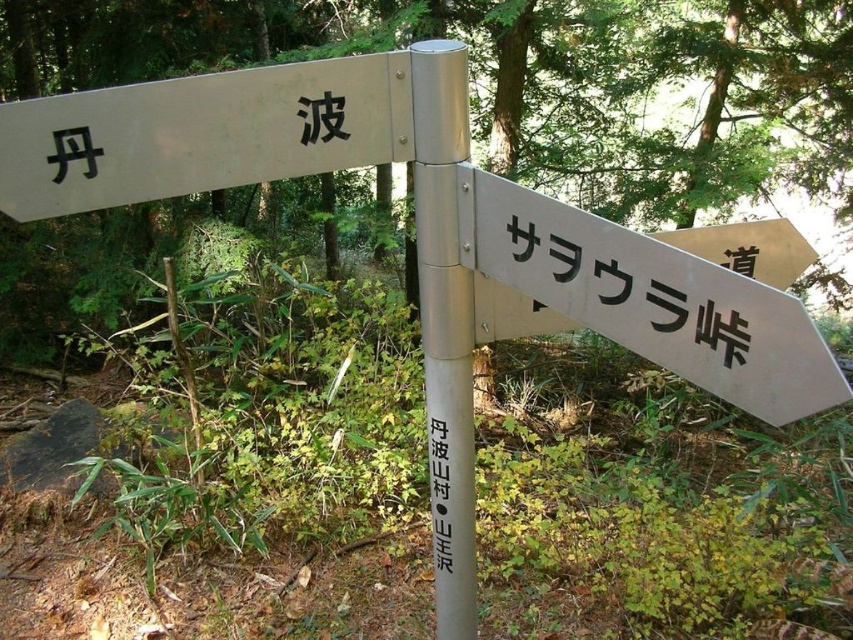
You are standing in front of the metal directional signpost in the forest. There are two points marked on the signpost. The first point is at coordinates point (x=664, y=314) and the second point is at point (x=471, y=499). Which of these points appears closer to you?

Point (x=664, y=314) is closer to the camera than point (x=471, y=499), so the first point appears closer to you.